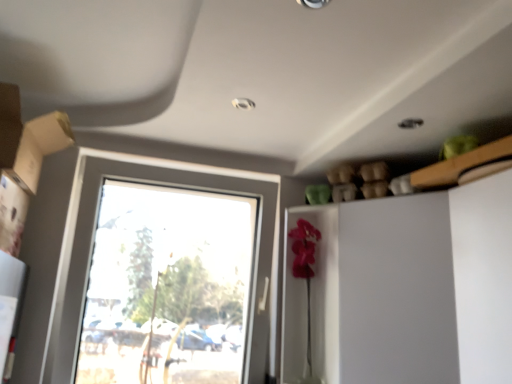
Question: Considering the relative sizes of clear glass window at center and matte cardboard box at left in the image provided, is clear glass window at center shorter than matte cardboard box at left?

Choices:
 (A) yes
 (B) no

Answer: (B)

Question: Is clear glass window at center bigger than matte cardboard box at left?

Choices:
 (A) no
 (B) yes

Answer: (B)

Question: Is clear glass window at center at the left side of matte cardboard box at left?

Choices:
 (A) no
 (B) yes

Answer: (A)

Question: From a real-world perspective, does clear glass window at center stand above matte cardboard box at left?

Choices:
 (A) yes
 (B) no

Answer: (B)

Question: Is the depth of clear glass window at center greater than that of matte cardboard box at left?

Choices:
 (A) yes
 (B) no

Answer: (A)

Question: Is clear glass window at center smaller than matte cardboard box at left?

Choices:
 (A) no
 (B) yes

Answer: (A)

Question: Is clear glass window at center completely or partially inside white glossy dresser at right?

Choices:
 (A) no
 (B) yes

Answer: (A)

Question: From the image's perspective, is white glossy dresser at right located beneath clear glass window at center?

Choices:
 (A) yes
 (B) no

Answer: (A)

Question: Is white glossy dresser at right thinner than clear glass window at center?

Choices:
 (A) no
 (B) yes

Answer: (A)

Question: Does white glossy dresser at right come behind clear glass window at center?

Choices:
 (A) yes
 (B) no

Answer: (B)

Question: Is there a large distance between white glossy dresser at right and clear glass window at center?

Choices:
 (A) yes
 (B) no

Answer: (B)

Question: Considering the relative sizes of white glossy dresser at right and clear glass window at center in the image provided, is white glossy dresser at right shorter than clear glass window at center?

Choices:
 (A) yes
 (B) no

Answer: (A)

Question: Does clear glass window at center have a larger size compared to white glossy dresser at right?

Choices:
 (A) no
 (B) yes

Answer: (A)